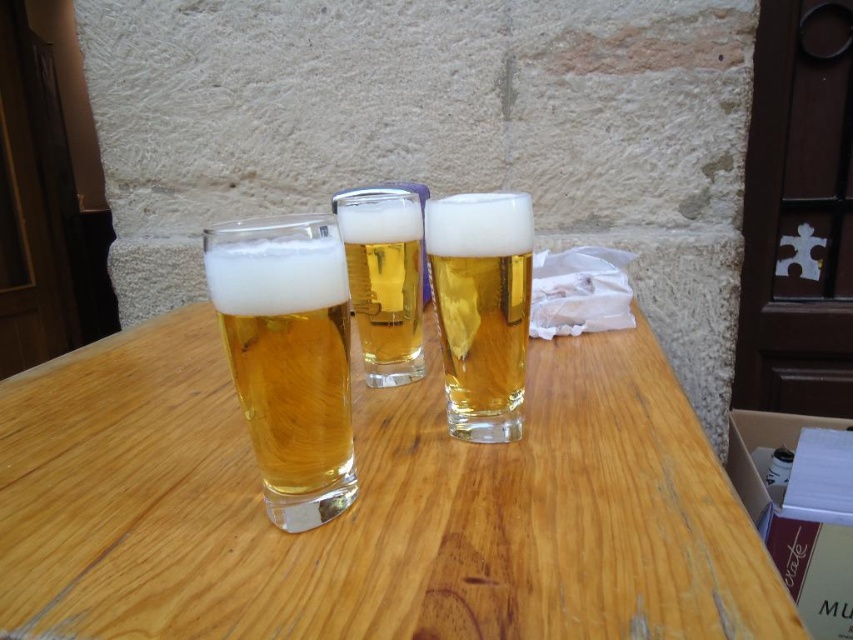
Question: Which object is positioned farthest from the clear glass beer at left?

Choices:
 (A) translucent glass at center
 (B) wooden table at center

Answer: (B)

Question: Which point appears closest to the camera in this image?

Choices:
 (A) (405, 376)
 (B) (339, 413)

Answer: (B)

Question: In this image, where is clear glass beer at left located relative to translucent glass at center?

Choices:
 (A) right
 (B) left

Answer: (B)

Question: Is clear glass beer at left to the left of translucent glass at center from the viewer's perspective?

Choices:
 (A) yes
 (B) no

Answer: (A)

Question: Which point is closer to the camera taking this photo?

Choices:
 (A) (402, 372)
 (B) (445, 371)

Answer: (B)

Question: Is wooden table at center thinner than clear glass beer at left?

Choices:
 (A) no
 (B) yes

Answer: (A)